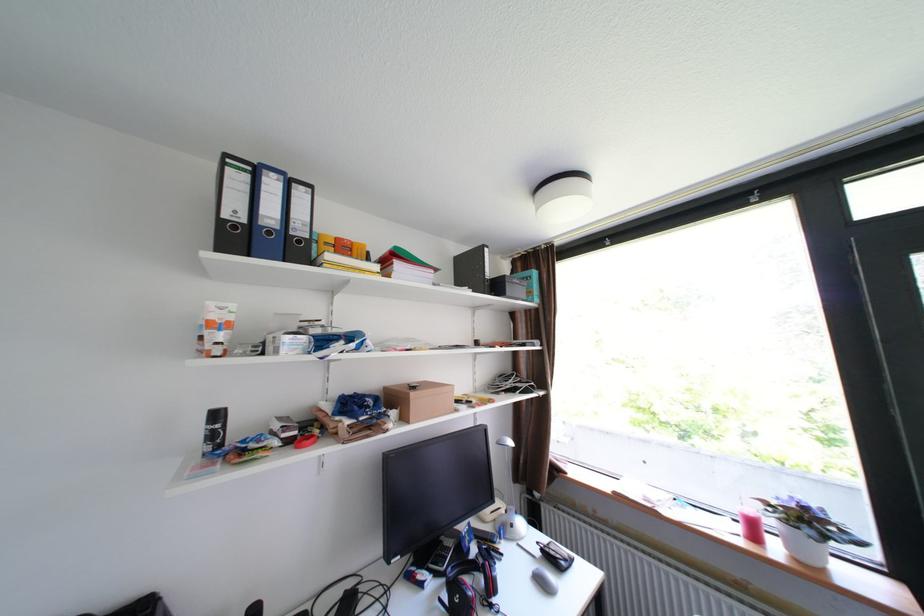
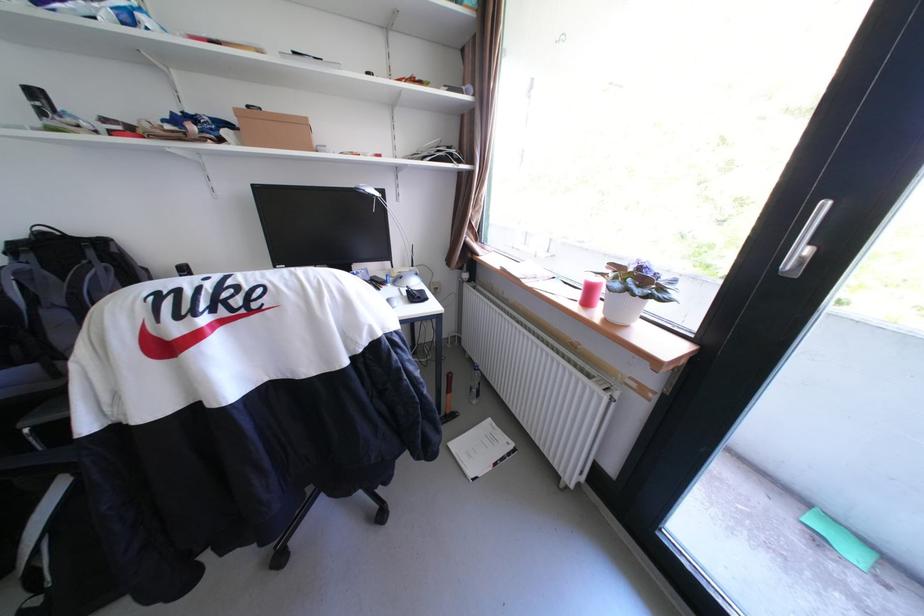
In the second image, find the point that corresponds to point 553,551 in the first image.

(418, 291)